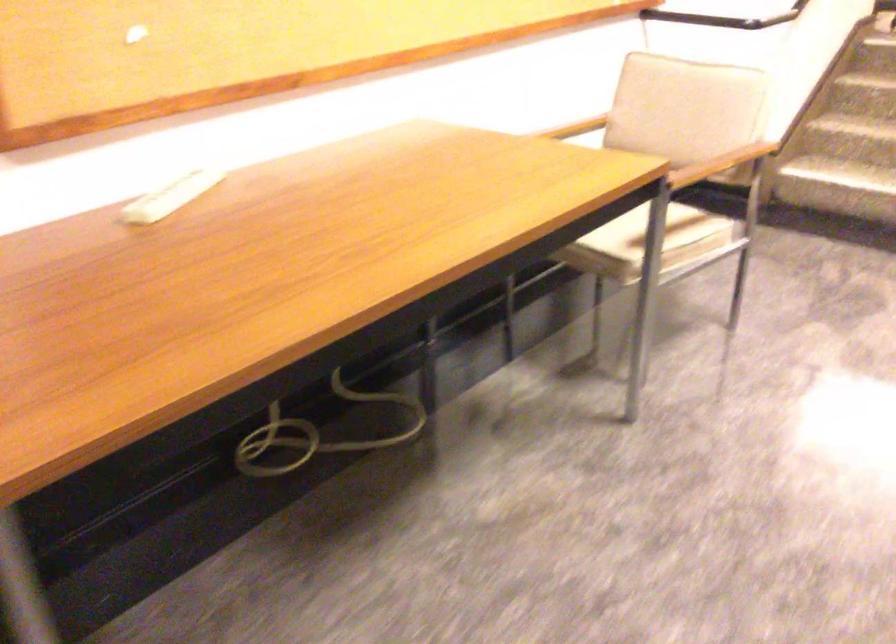
Locate an element on the screen. This screenshot has width=896, height=644. black stair handrail is located at coordinates (776, 17).